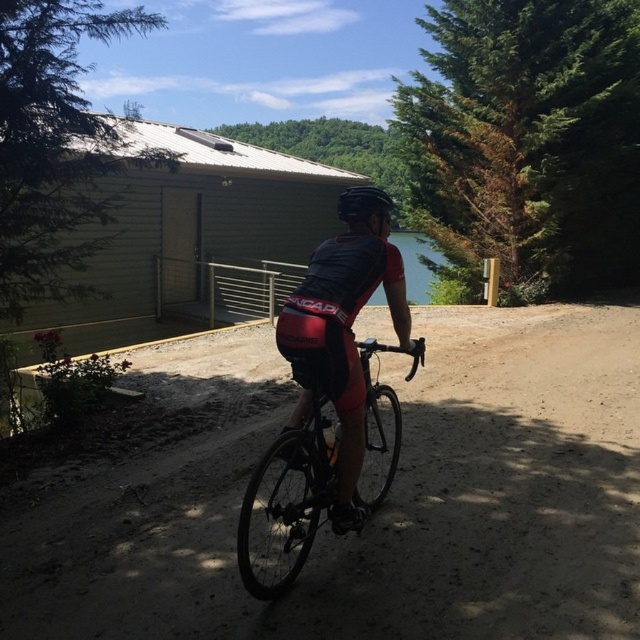
Question: Among these objects, which one is farthest from the camera?

Choices:
 (A) dirt/gravel road at center
 (B) clear blue water at center
 (C) matte black helmet at center

Answer: (C)

Question: Estimate the real-world distances between objects in this image. Which object is farther from the matte black helmet at center?

Choices:
 (A) clear blue water at center
 (B) dirt/gravel road at center

Answer: (A)

Question: Estimate the real-world distances between objects in this image. Which object is farther from the dirt/gravel road at center?

Choices:
 (A) shiny black bike at center
 (B) clear blue water at center
 (C) matte black helmet at center

Answer: (B)

Question: Can you confirm if shiny black bike at center is wider than matte black helmet at center?

Choices:
 (A) yes
 (B) no

Answer: (A)

Question: Does shiny black bike at center appear on the right side of matte black helmet at center?

Choices:
 (A) yes
 (B) no

Answer: (B)

Question: Is dirt/gravel road at center further to the viewer compared to matte black helmet at center?

Choices:
 (A) yes
 (B) no

Answer: (B)